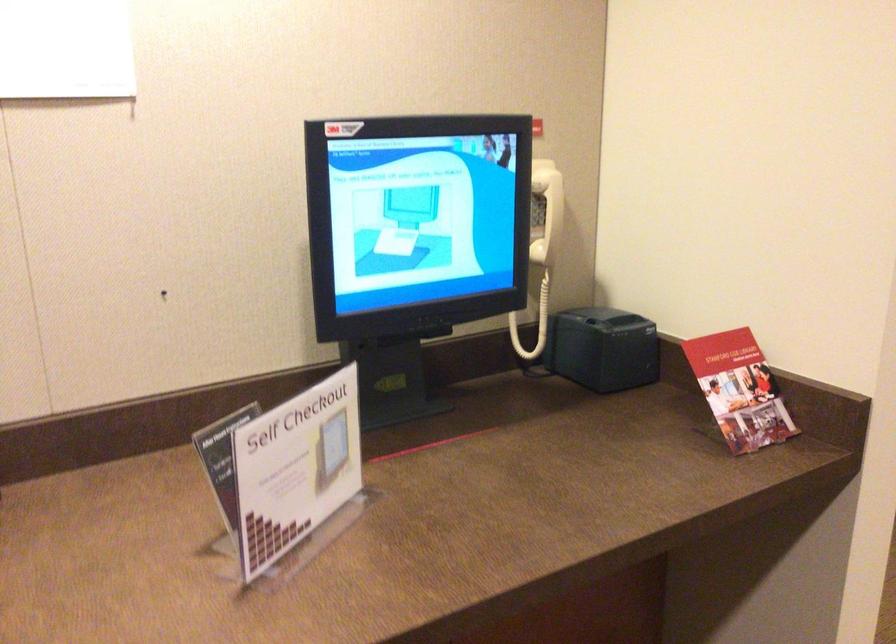
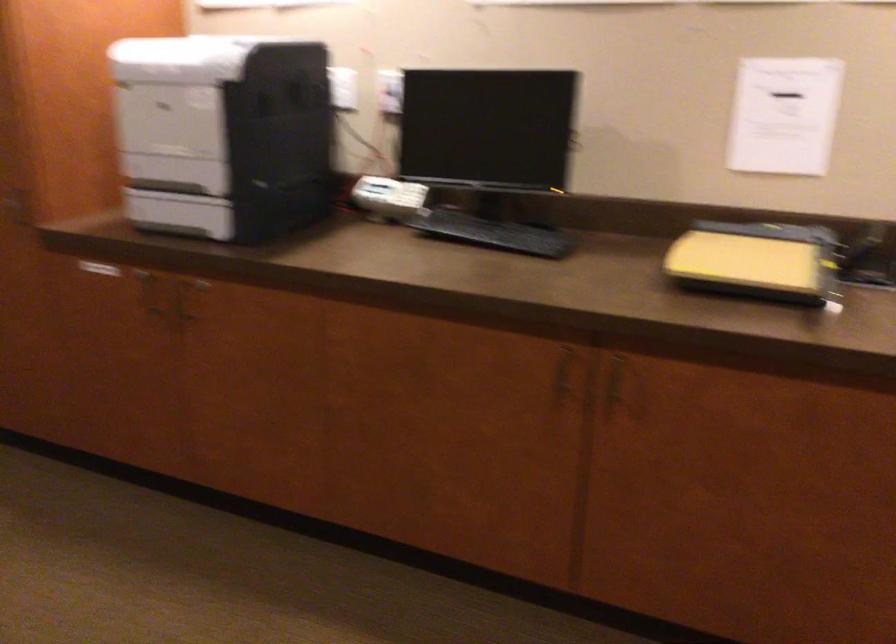
Question: The camera is either moving clockwise (left) or counter-clockwise (right) around the object. The first image is from the beginning of the video and the second image is from the end. Is the camera moving left or right when shooting the video?

Choices:
 (A) Left
 (B) Right

Answer: (B)